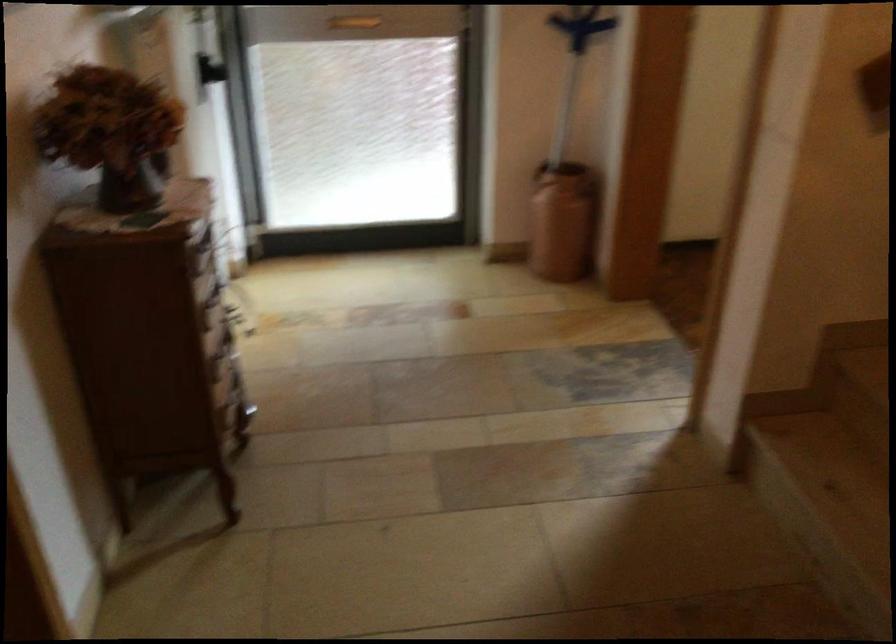
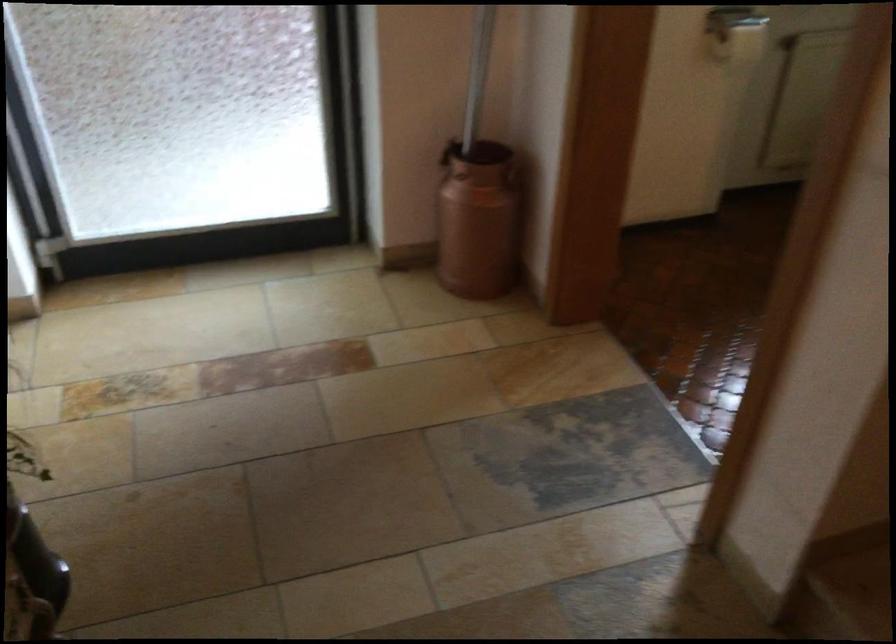
Where in the second image is the point corresponding to the point at 556,216 from the first image?

(478, 220)